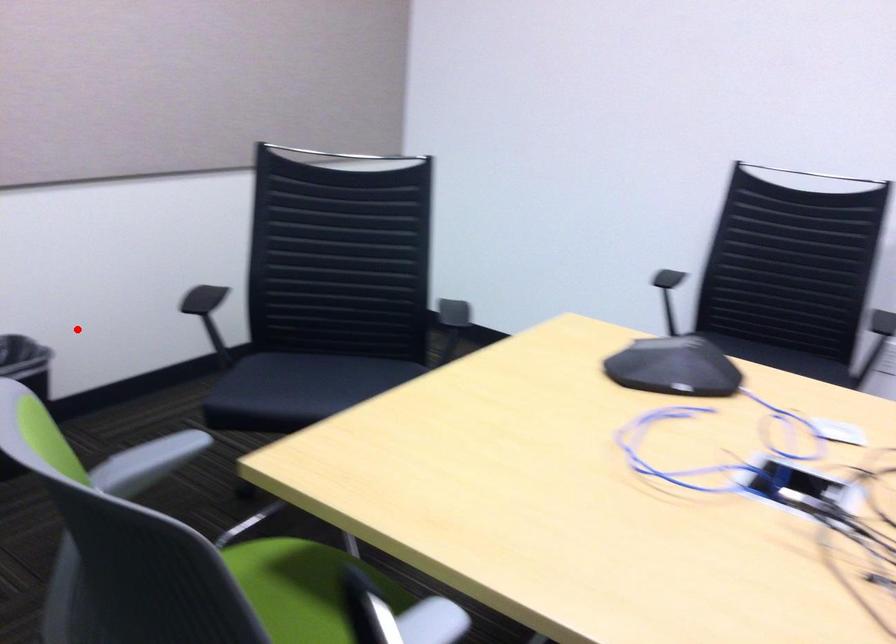
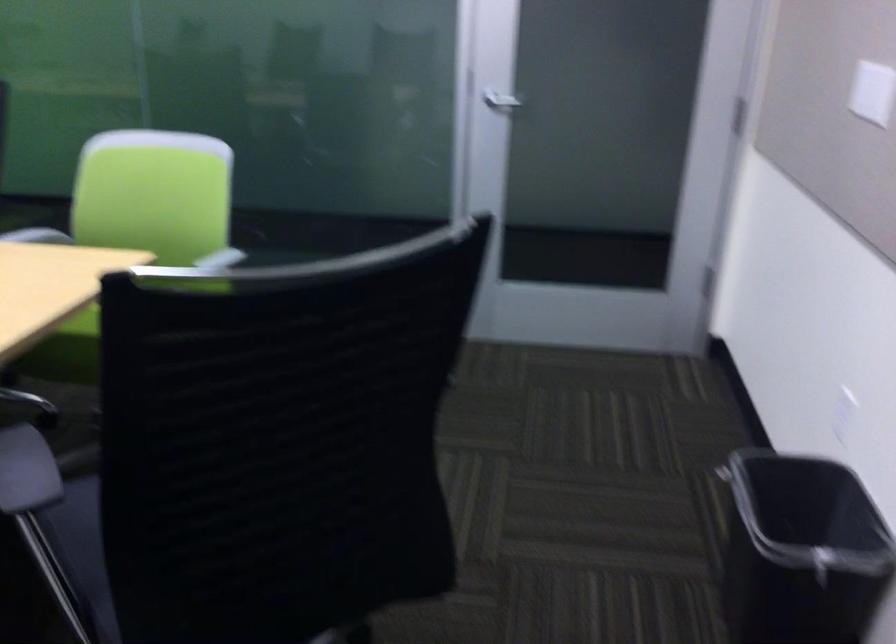
Find the pixel in the second image that matches the highlighted location in the first image.

(800, 552)